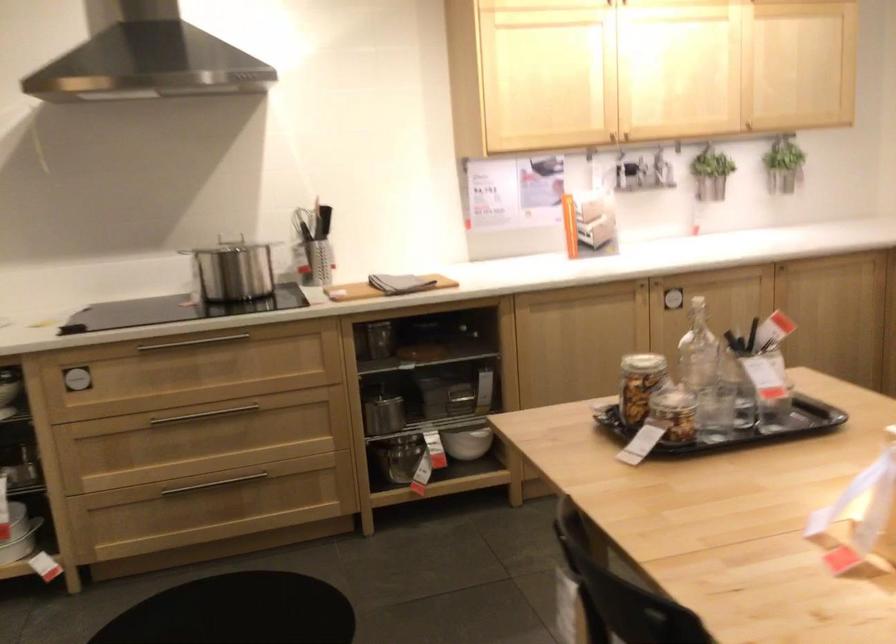
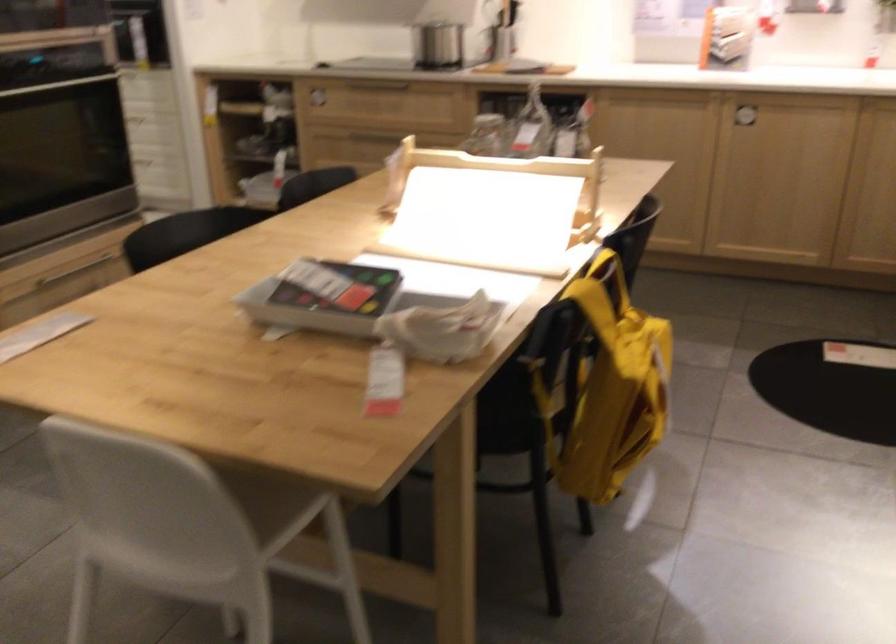
Find the pixel in the second image that matches the point at 717,305 in the first image.

(745, 118)